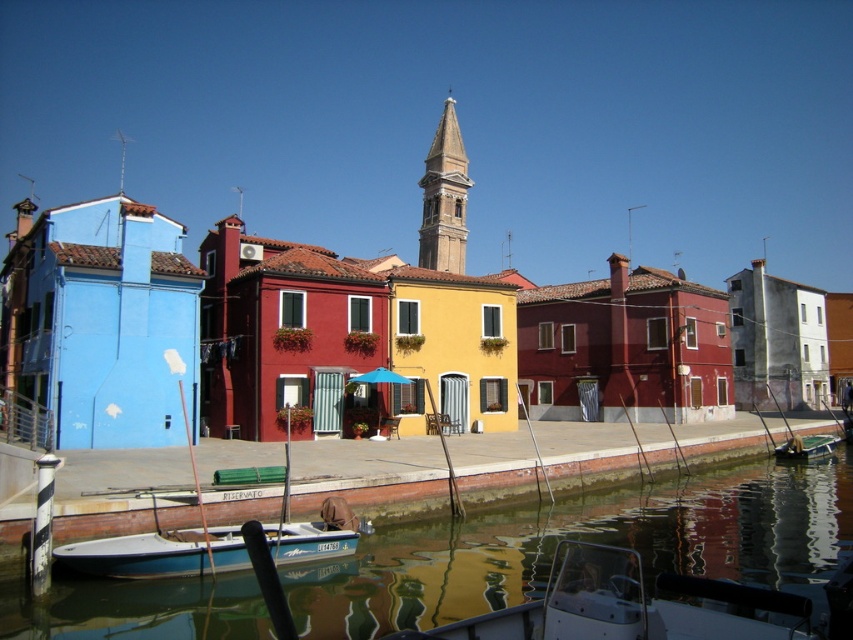
Between smooth concrete dock at center and white glossy boat at lower left, which one is positioned lower?

smooth concrete dock at center is below.

Between smooth concrete dock at center and white glossy boat at lower left, which one appears on the right side from the viewer's perspective?

From the viewer's perspective, smooth concrete dock at center appears more on the right side.

Between point (440, 504) and point (196, 563), which one is positioned behind?

Point (440, 504)

Identify the location of smooth concrete dock at center. (x=641, y=449).

Does smooth concrete dock at center come in front of smooth stone bell tower at center?

Yes, smooth concrete dock at center is closer to the viewer.

Is smooth concrete dock at center thinner than smooth stone bell tower at center?

No, smooth concrete dock at center is not thinner than smooth stone bell tower at center.

Is point (723, 456) closer to camera compared to point (460, 259)?

Yes.

Locate an element on the screen. smooth concrete dock at center is located at coordinates (641, 449).

Can you confirm if smooth concrete dock at center is thinner than white plastic boat at lower center?

No, smooth concrete dock at center is not thinner than white plastic boat at lower center.

Which of these two, smooth concrete dock at center or white plastic boat at lower center, stands taller?

white plastic boat at lower center is taller.

Describe the element at coordinates (641, 449) in the screenshot. The height and width of the screenshot is (640, 853). I see `smooth concrete dock at center` at that location.

The width and height of the screenshot is (853, 640). Identify the location of smooth concrete dock at center. (641, 449).